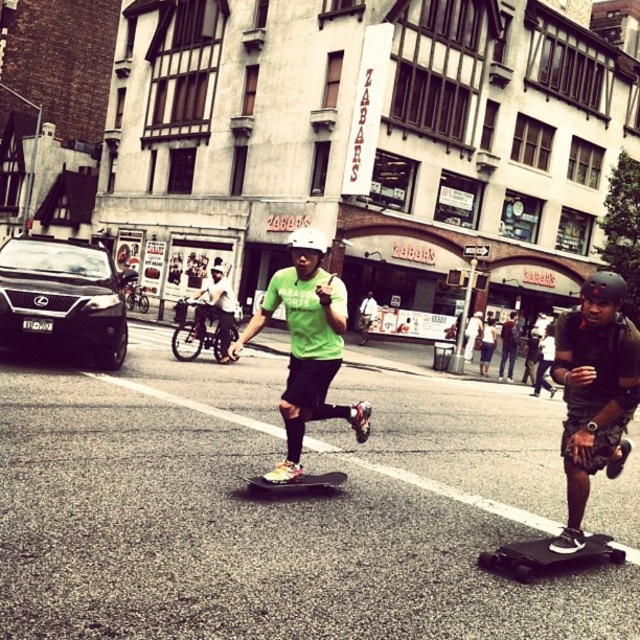
Does point (611, 557) lie behind point (513, 353)?

No, it is not.

Is black matte skateboard at center taller than dark gray helmet at center?

No.

Is point (490, 566) closer to viewer compared to point (513, 353)?

Yes, point (490, 566) is closer to viewer.

Identify the location of black matte skateboard at center. The image size is (640, 640). [x=545, y=556].

Identify the location of white helmet at center. (220, 308).

Does white helmet at center have a greater height compared to black rubber skateboard at center?

Yes.

The image size is (640, 640). I want to click on white helmet at center, so click(x=220, y=308).

Who is positioned more to the left, black matte skateboard at right or white helmet at center?

white helmet at center is more to the left.

Can you confirm if black matte skateboard at right is thinner than white helmet at center?

Yes, black matte skateboard at right is thinner than white helmet at center.

Does point (593, 440) come farther from viewer compared to point (216, 276)?

No, (593, 440) is in front of (216, 276).

This screenshot has height=640, width=640. I want to click on black matte skateboard at right, so click(593, 392).